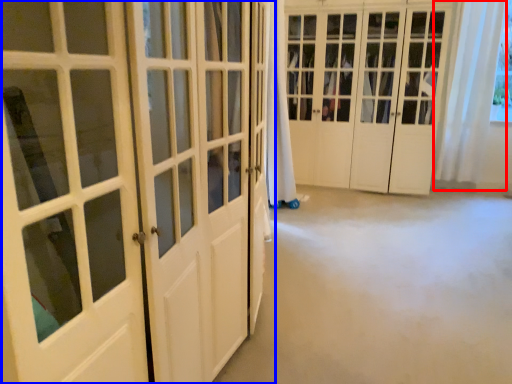
Question: Which point is further to the camera, curtain (highlighted by a red box) or door (highlighted by a blue box)?

Choices:
 (A) curtain
 (B) door

Answer: (A)